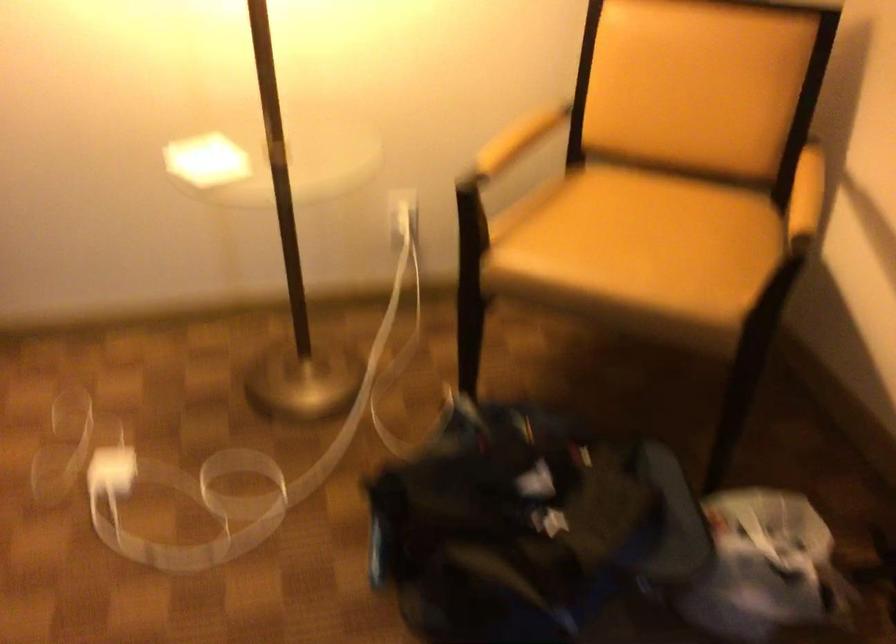
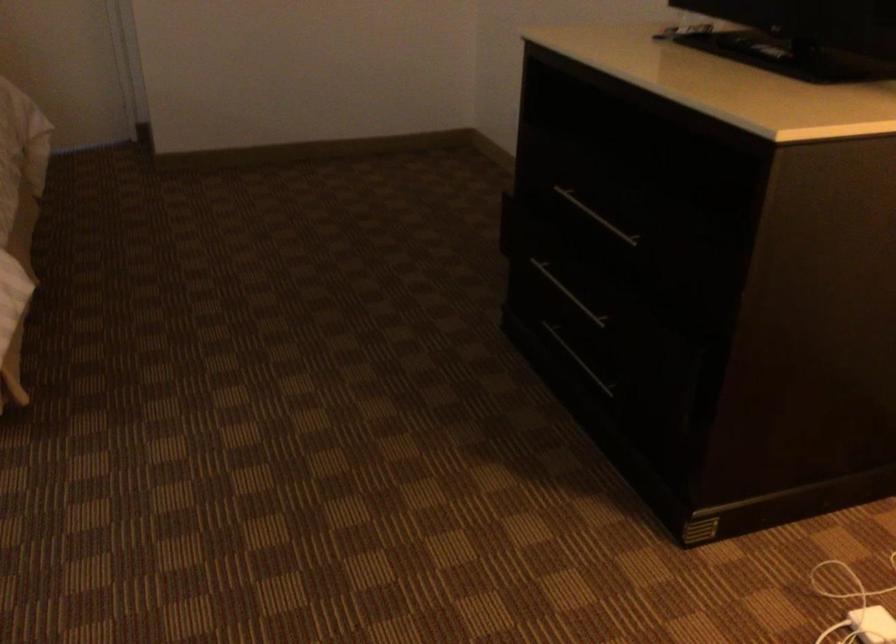
In the second image, find the point that corresponds to (104,482) in the first image.

(872, 625)